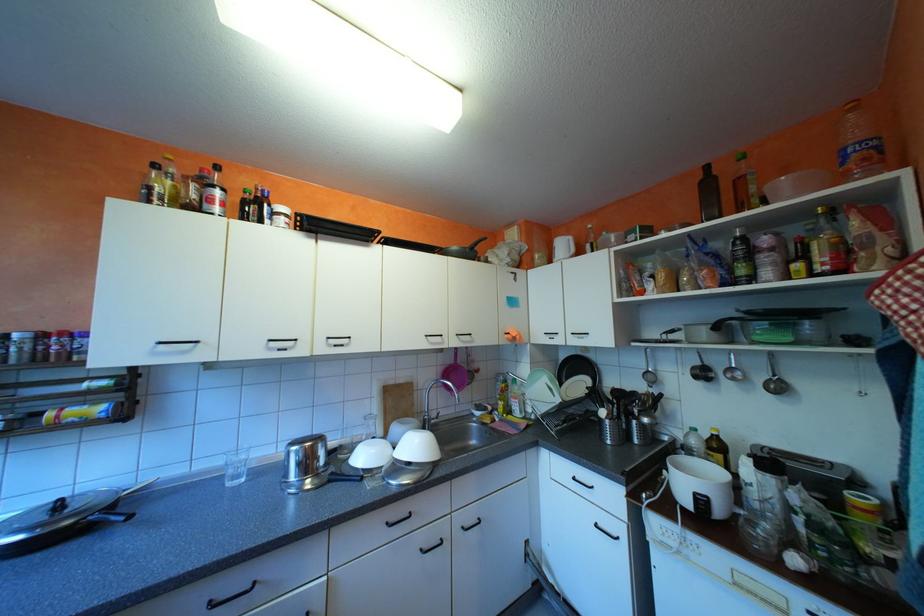
Where would you lift the pan handle? Please return your answer as a coordinate pair (x, y).

(477, 244)